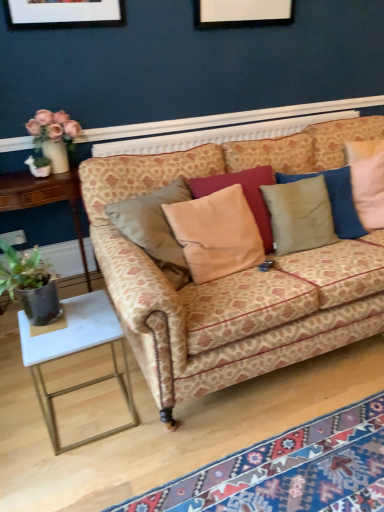
Question: Is patterned fabric couch at center wider or thinner than dark green leafy plant at left?

Choices:
 (A) wide
 (B) thin

Answer: (A)

Question: Is patterned fabric couch at center in front of or behind dark green leafy plant at left in the image?

Choices:
 (A) behind
 (B) front

Answer: (B)

Question: Considering the real-world distances, which object is closest to the patterned fabric couch at center?

Choices:
 (A) white marble table at left, the 1th table positioned from the top
 (B) white marble side table at lower left, the 2th table from the top
 (C) carpet with geometric patterns at lower right
 (D) velvet beige pillow at center, which ranks as the second pillow in left-to-right order
 (E) matte ceramic vase at upper left

Answer: (D)

Question: Estimate the real-world distances between objects in this image. Which object is closer to the white marble table at left, which is counted as the first table, starting from the back?

Choices:
 (A) velvet beige pillow at center, which appears as the first pillow when viewed from the right
 (B) patterned fabric couch at center
 (C) dark green leafy plant at left
 (D) beige fabric pillow at center, which appears as the first pillow when viewed from the left
 (E) carpet with geometric patterns at lower right

Answer: (C)